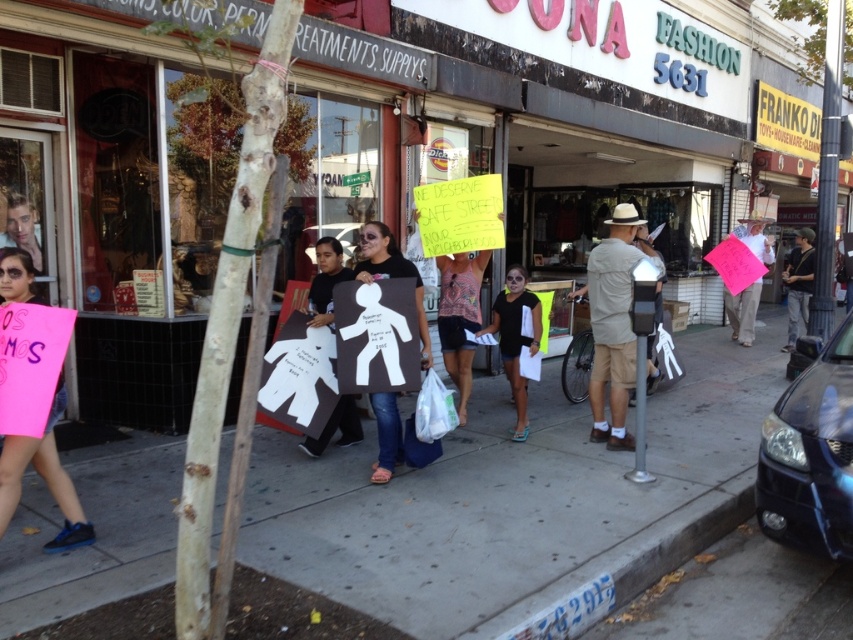
Is pink paper sign at left to the left of matte black sign at center from the viewer's perspective?

Yes, pink paper sign at left is to the left of matte black sign at center.

Does pink paper sign at left have a smaller size compared to matte black sign at center?

Correct, pink paper sign at left occupies less space than matte black sign at center.

The height and width of the screenshot is (640, 853). What do you see at coordinates (44, 480) in the screenshot?
I see `pink paper sign at left` at bounding box center [44, 480].

Find the location of a particular element. The image size is (853, 640). pink paper sign at left is located at coordinates (44, 480).

Can you confirm if matte black shorts at center is positioned above white paper figure at center?

Correct, matte black shorts at center is located above white paper figure at center.

Which is more to the right, matte black shorts at center or white paper figure at center?

From the viewer's perspective, matte black shorts at center appears more on the right side.

In order to click on matte black shorts at center in this screenshot , I will do `click(515, 339)`.

Measure the distance between matte black sign at center and dark gray shirt at center.

matte black sign at center and dark gray shirt at center are 28.15 feet apart.

Is matte black sign at center positioned at the back of dark gray shirt at center?

No, it is in front of dark gray shirt at center.

Locate an element on the screen. matte black sign at center is located at coordinates (392, 273).

Image resolution: width=853 pixels, height=640 pixels. Identify the location of matte black sign at center. (392, 273).